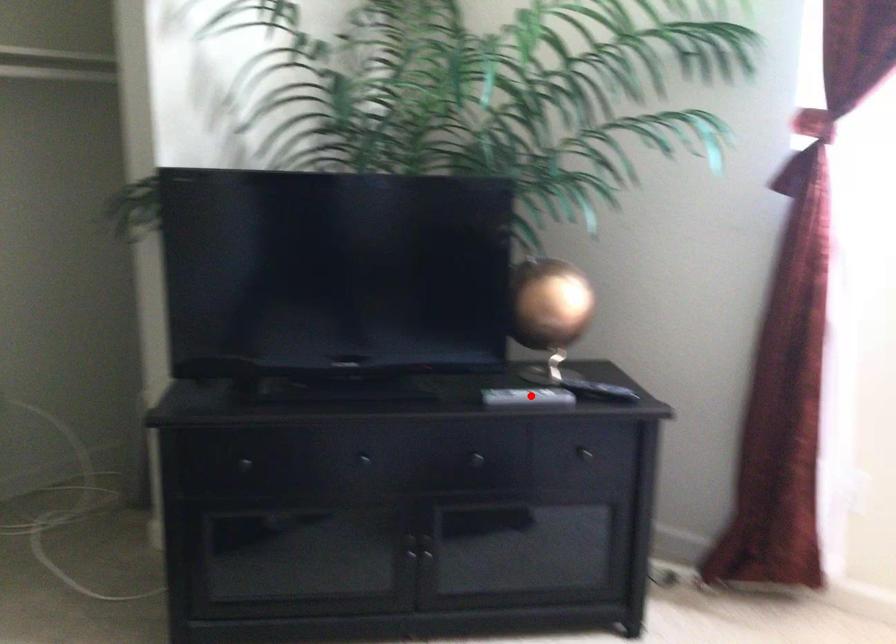
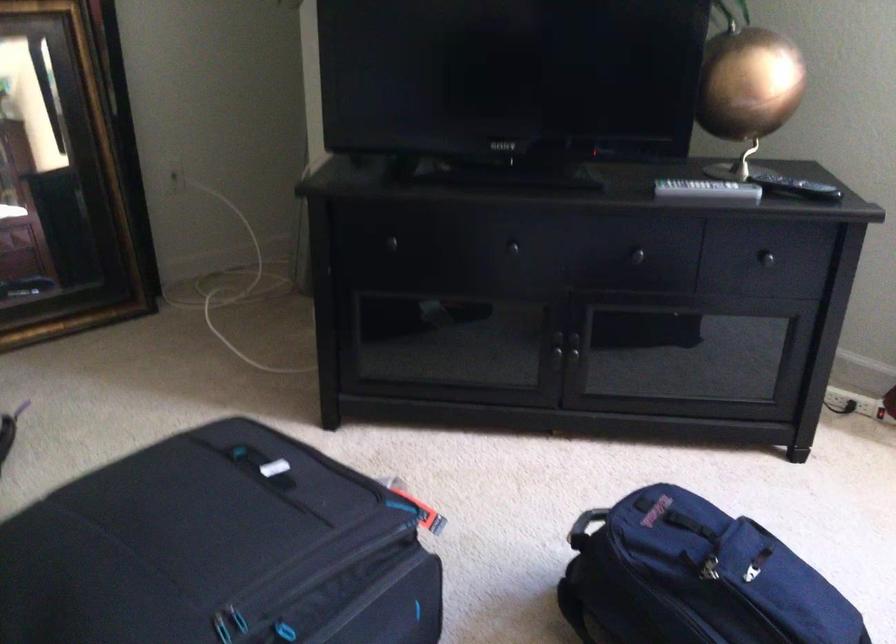
Find the pixel in the second image that matches the highlighted location in the first image.

(707, 190)